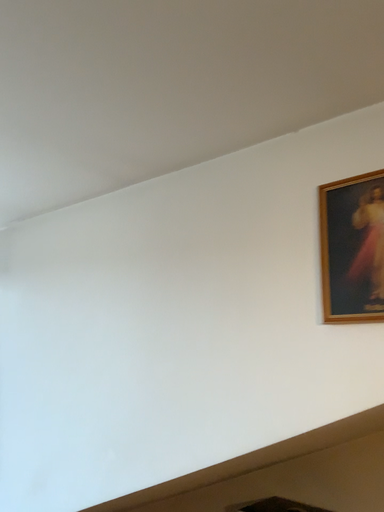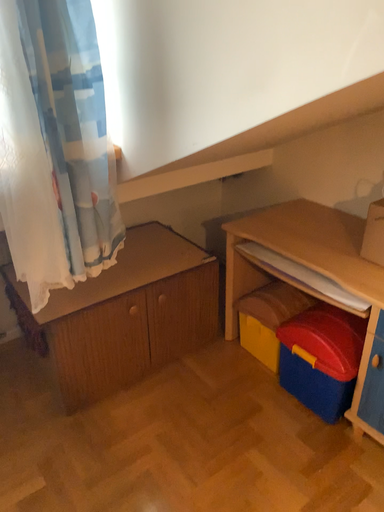
Question: How did the camera likely rotate when shooting the video?

Choices:
 (A) rotated upward
 (B) rotated downward

Answer: (B)